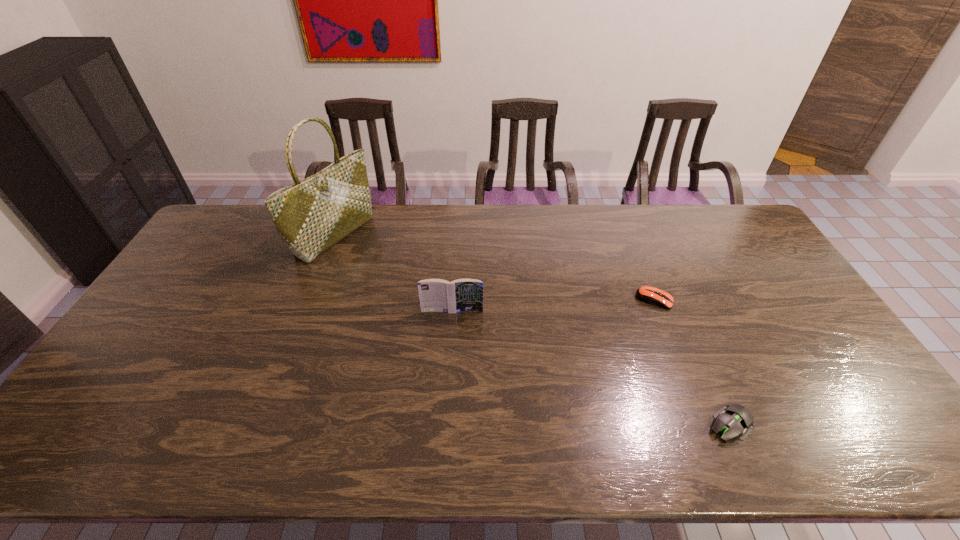
Identify the location of vacant point that satisfies the following two spatial constraints: 1. on the front side of the nearest object; 2. on the left side of the farther computer mouse. This screenshot has height=540, width=960. (703, 424).

The width and height of the screenshot is (960, 540). Identify the location of free region that satisfies the following two spatial constraints: 1. on the front side of the farther computer mouse; 2. on the right side of the nearest object. (703, 424).